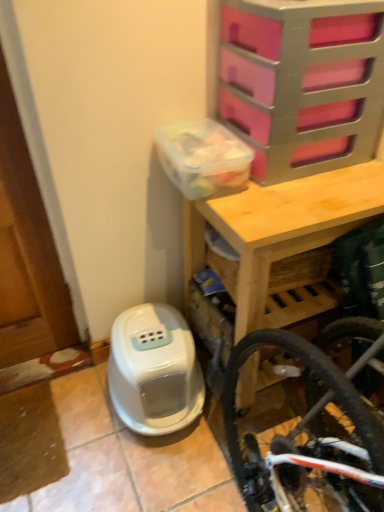
Question: Is wooden table at upper center facing away from white plastic water heater at lower left?

Choices:
 (A) no
 (B) yes

Answer: (A)

Question: Is wooden table at upper center closer to camera compared to white plastic water heater at lower left?

Choices:
 (A) yes
 (B) no

Answer: (A)

Question: Is wooden table at upper center next to white plastic water heater at lower left and touching it?

Choices:
 (A) no
 (B) yes

Answer: (A)

Question: Is the position of wooden table at upper center more distant than that of white plastic water heater at lower left?

Choices:
 (A) yes
 (B) no

Answer: (B)

Question: Is wooden table at upper center at the left side of white plastic water heater at lower left?

Choices:
 (A) no
 (B) yes

Answer: (A)

Question: From the image's perspective, is wooden table at upper center above white plastic water heater at lower left?

Choices:
 (A) no
 (B) yes

Answer: (B)

Question: Does white plastic water heater at lower left appear on the right side of pink plastic drawer at upper right?

Choices:
 (A) no
 (B) yes

Answer: (A)

Question: Is white plastic water heater at lower left facing away from pink plastic drawer at upper right?

Choices:
 (A) no
 (B) yes

Answer: (A)

Question: Does white plastic water heater at lower left have a greater height compared to pink plastic drawer at upper right?

Choices:
 (A) no
 (B) yes

Answer: (A)

Question: Are white plastic water heater at lower left and pink plastic drawer at upper right located far from each other?

Choices:
 (A) yes
 (B) no

Answer: (B)

Question: From a real-world perspective, is white plastic water heater at lower left positioned over pink plastic drawer at upper right based on gravity?

Choices:
 (A) yes
 (B) no

Answer: (B)

Question: From the image's perspective, is white plastic water heater at lower left beneath pink plastic drawer at upper right?

Choices:
 (A) yes
 (B) no

Answer: (A)

Question: From the image's perspective, would you say pink plastic drawer at upper right is positioned over white plastic water heater at lower left?

Choices:
 (A) yes
 (B) no

Answer: (A)